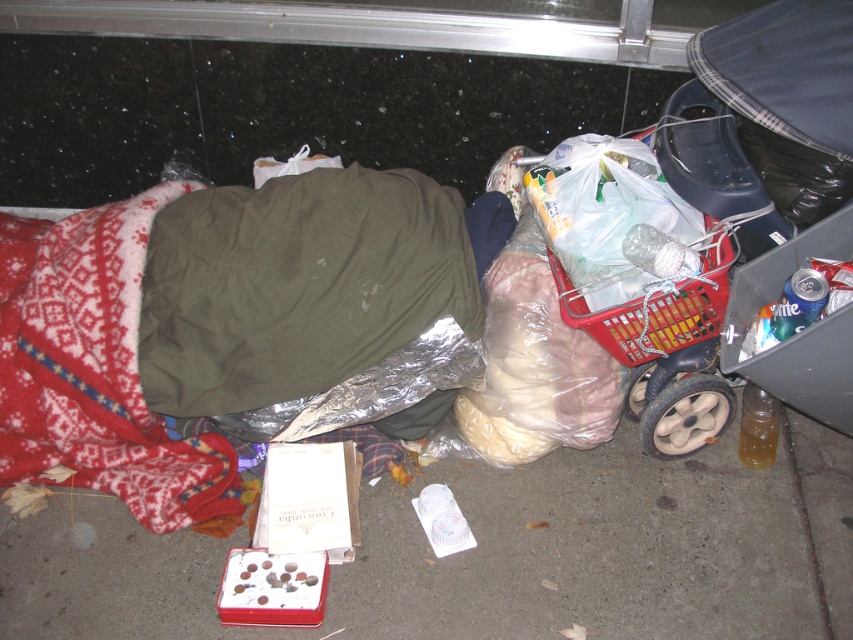
Question: Does smooth concrete pavement at lower center appear over olive green fabric sleeping bag at center?

Choices:
 (A) yes
 (B) no

Answer: (B)

Question: Among these objects, which one is nearest to the camera?

Choices:
 (A) olive green fabric sleeping bag at center
 (B) smooth concrete pavement at lower center

Answer: (B)

Question: Does smooth concrete pavement at lower center have a greater width compared to red fleece blanket at lower left?

Choices:
 (A) no
 (B) yes

Answer: (B)

Question: Which object is the farthest from the red fleece blanket at lower left?

Choices:
 (A) olive green fabric sleeping bag at center
 (B) smooth concrete pavement at lower center

Answer: (B)

Question: Which object is positioned closest to the olive green fabric sleeping bag at center?

Choices:
 (A) smooth concrete pavement at lower center
 (B) red fleece blanket at lower left

Answer: (B)

Question: Can you confirm if olive green fabric sleeping bag at center is positioned above red fleece blanket at lower left?

Choices:
 (A) no
 (B) yes

Answer: (B)